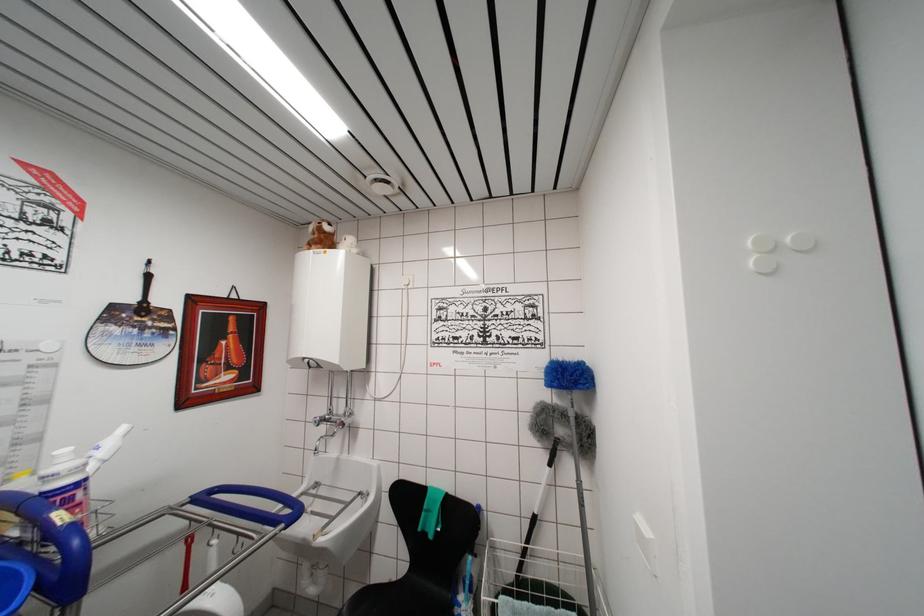
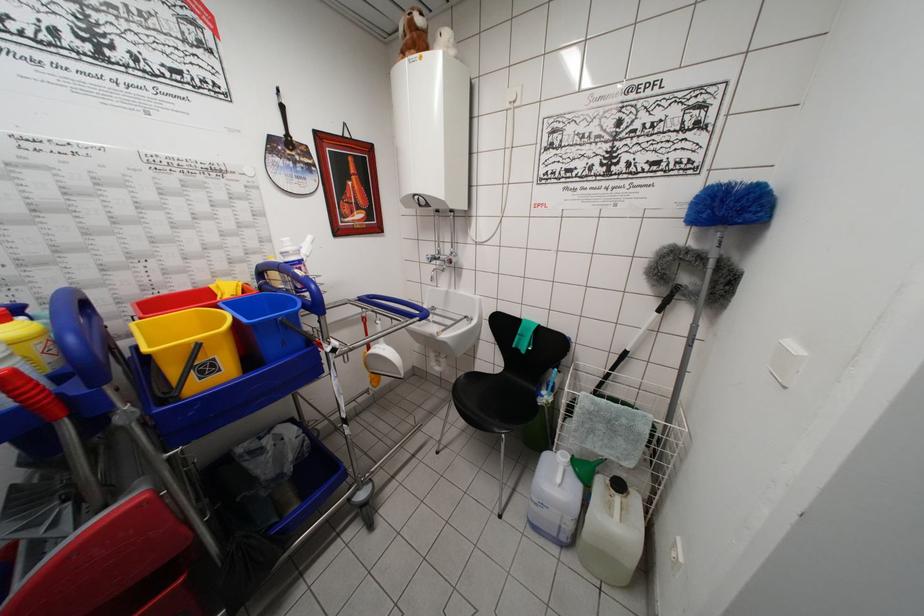
Where in the second image is the point corresponding to point 533,522 from the first image?

(624, 358)